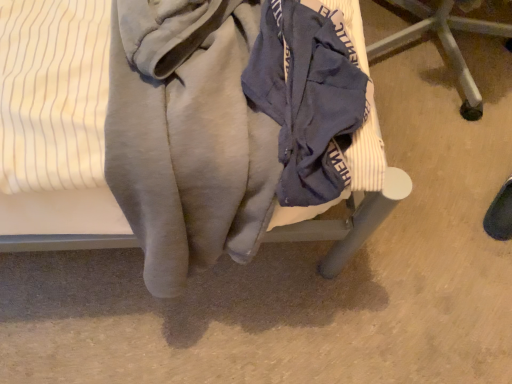
Locate an element on the screen. Image resolution: width=512 pixels, height=384 pixels. blue fabric chair at center, which is counted as the first furniture, starting from the right is located at coordinates (444, 44).

The image size is (512, 384). What do you see at coordinates (307, 96) in the screenshot?
I see `navy blue fabric at center` at bounding box center [307, 96].

This screenshot has height=384, width=512. What do you see at coordinates (63, 221) in the screenshot? I see `velvet-like fabric chair at center, the first furniture in the left-to-right sequence` at bounding box center [63, 221].

Identify the location of blue fabric chair at center, which is the 2th furniture in left-to-right order. This screenshot has width=512, height=384. (444, 44).

Is point (451, 18) closer or farther from the camera than point (74, 198)?

Point (451, 18) is farther from the camera than point (74, 198).

Between blue fabric chair at center, which is counted as the first furniture, starting from the right, and velvet-like fabric chair at center, the first furniture in the left-to-right sequence, which one is positioned in front?

Positioned in front is velvet-like fabric chair at center, the first furniture in the left-to-right sequence.

Which object is positioned more to the right, blue fabric chair at center, which is the 2th furniture in left-to-right order, or velvet-like fabric chair at center, the first furniture in the left-to-right sequence?

blue fabric chair at center, which is the 2th furniture in left-to-right order, is more to the right.

Is blue fabric chair at center, which is the 2th furniture in left-to-right order, looking in the opposite direction of velvet-like fabric chair at center, the first furniture in the left-to-right sequence?

Correct, blue fabric chair at center, which is the 2th furniture in left-to-right order, is looking away from velvet-like fabric chair at center, the first furniture in the left-to-right sequence.

In the scene shown: Does navy blue fabric at center have a lesser width compared to blue fabric chair at center, which is the 2th furniture in left-to-right order?

Indeed, navy blue fabric at center has a lesser width compared to blue fabric chair at center, which is the 2th furniture in left-to-right order.

Is navy blue fabric at center to the right of blue fabric chair at center, which is counted as the first furniture, starting from the right, from the viewer's perspective?

No, navy blue fabric at center is not to the right of blue fabric chair at center, which is counted as the first furniture, starting from the right.

Between navy blue fabric at center and blue fabric chair at center, which is counted as the first furniture, starting from the right, which one has less height?

navy blue fabric at center is shorter.

Considering their positions, is navy blue fabric at center located in front of or behind blue fabric chair at center, which is counted as the first furniture, starting from the right?

Visually, navy blue fabric at center is located in front of blue fabric chair at center, which is counted as the first furniture, starting from the right.

From a real-world perspective, is velvet-like fabric chair at center, the second furniture when ordered from right to left, over blue fabric chair at center, which is the 2th furniture in left-to-right order?

Yes.

You are a GUI agent. You are given a task and a screenshot of the screen. Output one action in this format:
    pyautogui.click(x=<x>, y=<y>)
    Task: Click on the furniture in front of the blue fabric chair at center, which is the 2th furniture in left-to-right order
    The height and width of the screenshot is (384, 512).
    Given the screenshot: What is the action you would take?
    (63, 221)

Which is behind, velvet-like fabric chair at center, the second furniture when ordered from right to left, or blue fabric chair at center, which is the 2th furniture in left-to-right order?

blue fabric chair at center, which is the 2th furniture in left-to-right order, is behind.

Is velvet-like fabric chair at center, the second furniture when ordered from right to left, next to blue fabric chair at center, which is the 2th furniture in left-to-right order?

velvet-like fabric chair at center, the second furniture when ordered from right to left, and blue fabric chair at center, which is the 2th furniture in left-to-right order, are clearly separated.

Between point (477, 89) and point (339, 124), which one is positioned in front?

The point (339, 124) is more forward.

Which of these two, blue fabric chair at center, which is the 2th furniture in left-to-right order, or navy blue fabric at center, is bigger?

With larger size is blue fabric chair at center, which is the 2th furniture in left-to-right order.

Is blue fabric chair at center, which is counted as the first furniture, starting from the right, far from navy blue fabric at center?

That's not correct — blue fabric chair at center, which is counted as the first furniture, starting from the right, is a little close to navy blue fabric at center.

From a real-world perspective, which object rests below the other?

velvet-like fabric chair at center, the second furniture when ordered from right to left, is physically lower.

Is navy blue fabric at center touching velvet-like fabric chair at center, the second furniture when ordered from right to left?

navy blue fabric at center and velvet-like fabric chair at center, the second furniture when ordered from right to left, are clearly separated.

At what (x,y) coordinates should I click in order to perform the action: click on garment above the velvet-like fabric chair at center, the second furniture when ordered from right to left (from a real-world perspective). Please return your answer as a coordinate pair (x, y). The image size is (512, 384). Looking at the image, I should click on (307, 96).

What's the angular difference between navy blue fabric at center and velvet-like fabric chair at center, the second furniture when ordered from right to left,'s facing directions?

The angular difference between navy blue fabric at center and velvet-like fabric chair at center, the second furniture when ordered from right to left, is 90 degrees.

Considering the points (130, 245) and (335, 81), which point is behind, point (130, 245) or point (335, 81)?

The point (130, 245) is behind.

Where is `garment located above the velvet-like fabric chair at center, the second furniture when ordered from right to left (from a real-world perspective)`? This screenshot has height=384, width=512. garment located above the velvet-like fabric chair at center, the second furniture when ordered from right to left (from a real-world perspective) is located at coordinates (307, 96).

Is velvet-like fabric chair at center, the second furniture when ordered from right to left, facing towards navy blue fabric at center?

Yes, velvet-like fabric chair at center, the second furniture when ordered from right to left, is turned towards navy blue fabric at center.

The height and width of the screenshot is (384, 512). Identify the location of furniture above the blue fabric chair at center, which is the 2th furniture in left-to-right order (from a real-world perspective). (63, 221).

The image size is (512, 384). What are the coordinates of `furniture behind the navy blue fabric at center` in the screenshot? It's located at (444, 44).

Which object lies nearer to the anchor point velvet-like fabric chair at center, the second furniture when ordered from right to left, blue fabric chair at center, which is the 2th furniture in left-to-right order, or navy blue fabric at center?

navy blue fabric at center.

Based on their spatial positions, is navy blue fabric at center or blue fabric chair at center, which is the 2th furniture in left-to-right order, further from velvet-like fabric chair at center, the second furniture when ordered from right to left?

The object further to velvet-like fabric chair at center, the second furniture when ordered from right to left, is blue fabric chair at center, which is the 2th furniture in left-to-right order.

Considering their positions, is blue fabric chair at center, which is the 2th furniture in left-to-right order, positioned further to navy blue fabric at center than velvet-like fabric chair at center, the second furniture when ordered from right to left?

blue fabric chair at center, which is the 2th furniture in left-to-right order, lies further to navy blue fabric at center than the other object.

Looking at this image, when comparing their distances from blue fabric chair at center, which is the 2th furniture in left-to-right order, does velvet-like fabric chair at center, the second furniture when ordered from right to left, or navy blue fabric at center seem further?

The object further to blue fabric chair at center, which is the 2th furniture in left-to-right order, is navy blue fabric at center.

From the image, which object appears to be nearer to blue fabric chair at center, which is the 2th furniture in left-to-right order, navy blue fabric at center or velvet-like fabric chair at center, the second furniture when ordered from right to left?

The object closer to blue fabric chair at center, which is the 2th furniture in left-to-right order, is velvet-like fabric chair at center, the second furniture when ordered from right to left.

Looking at the image, which one is located closer to navy blue fabric at center, velvet-like fabric chair at center, the first furniture in the left-to-right sequence, or blue fabric chair at center, which is counted as the first furniture, starting from the right?

Based on the image, velvet-like fabric chair at center, the first furniture in the left-to-right sequence, appears to be nearer to navy blue fabric at center.

Locate an element on the screen. The height and width of the screenshot is (384, 512). garment located between velvet-like fabric chair at center, the first furniture in the left-to-right sequence, and blue fabric chair at center, which is the 2th furniture in left-to-right order, in the left-right direction is located at coordinates (307, 96).